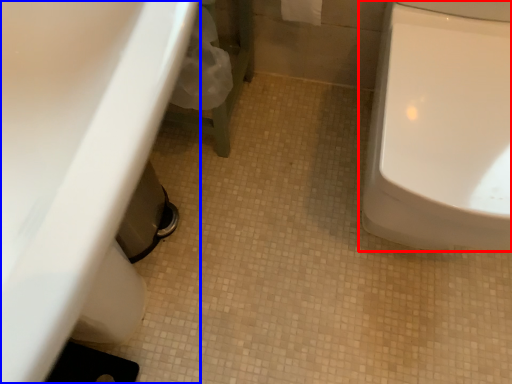
Question: Which object is further to the camera taking this photo, toilet (highlighted by a red box) or sink (highlighted by a blue box)?

Choices:
 (A) toilet
 (B) sink

Answer: (A)